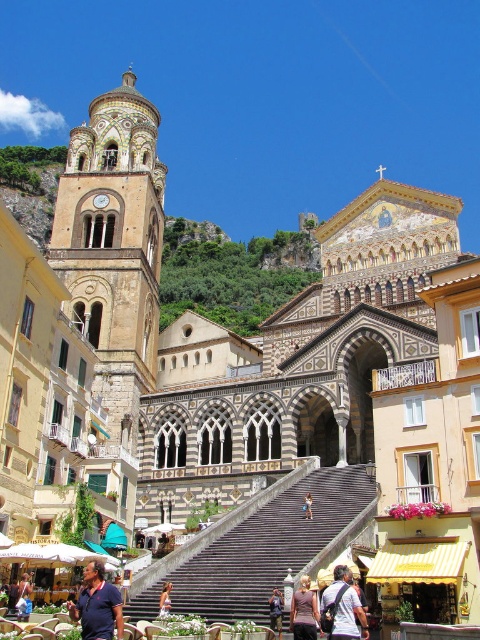
Does point (300, 637) lie behind point (308, 515)?

No, it is in front of (308, 515).

Is purple fabric shirt at center taller than light brown wooden chair at center?

Yes.

Locate an element on the screen. The width and height of the screenshot is (480, 640). purple fabric shirt at center is located at coordinates (303, 611).

Does point (349, 637) come farther from viewer compared to point (168, 609)?

That is False.

Does dark brown leather backpack at center appear on the left side of purple floral dress at center?

In fact, dark brown leather backpack at center is to the right of purple floral dress at center.

Is point (322, 602) more distant than point (163, 596)?

No, (322, 602) is in front of (163, 596).

The image size is (480, 640). In order to click on dark brown leather backpack at center in this screenshot , I will do `click(344, 605)`.

Which is below, black stone stairs at center or purple floral dress at center?

purple floral dress at center is lower down.

Which is above, black stone stairs at center or purple floral dress at center?

black stone stairs at center is higher up.

Which is in front, point (196, 602) or point (164, 605)?

Point (164, 605) is in front.

Image resolution: width=480 pixels, height=640 pixels. In order to click on black stone stairs at center in this screenshot , I will do [x=264, y=548].